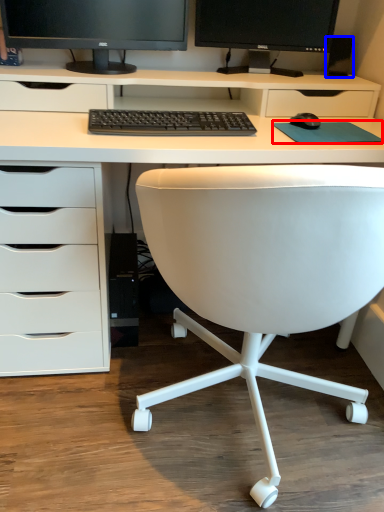
Question: Which point is closer to the camera, mousepad (highlighted by a red box) or speaker (highlighted by a blue box)?

Choices:
 (A) mousepad
 (B) speaker

Answer: (A)